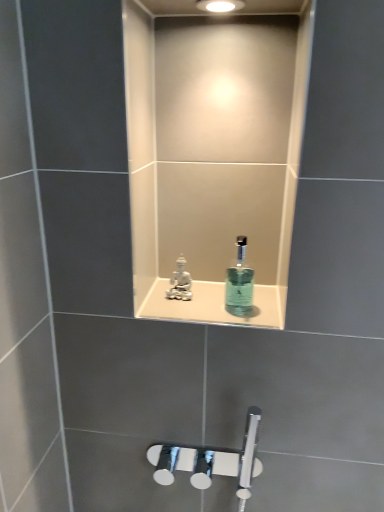
Question: Can you confirm if white glossy statue at center is taller than translucent glass mouthwash at center?

Choices:
 (A) yes
 (B) no

Answer: (B)

Question: From the image's perspective, is white glossy statue at center located above translucent glass mouthwash at center?

Choices:
 (A) yes
 (B) no

Answer: (B)

Question: Does white glossy statue at center lie behind translucent glass mouthwash at center?

Choices:
 (A) yes
 (B) no

Answer: (A)

Question: Does white glossy statue at center have a larger size compared to translucent glass mouthwash at center?

Choices:
 (A) yes
 (B) no

Answer: (B)

Question: Is translucent glass mouthwash at center at the back of white glossy statue at center?

Choices:
 (A) yes
 (B) no

Answer: (B)

Question: From a real-world perspective, is translucent glass mouthwash at center above or below white glossy statue at center?

Choices:
 (A) below
 (B) above

Answer: (B)

Question: Based on their positions, is translucent glass mouthwash at center located to the left or right of white glossy statue at center?

Choices:
 (A) left
 (B) right

Answer: (B)

Question: Would you say translucent glass mouthwash at center is inside or outside white glossy statue at center?

Choices:
 (A) outside
 (B) inside

Answer: (A)

Question: From their relative heights in the image, would you say translucent glass mouthwash at center is taller or shorter than white glossy statue at center?

Choices:
 (A) tall
 (B) short

Answer: (A)

Question: Looking at their shapes, would you say translucent glass mouthwash at center is wider or thinner than white porcelain figurine at center?

Choices:
 (A) wide
 (B) thin

Answer: (A)

Question: Is translucent glass mouthwash at center situated inside white porcelain figurine at center or outside?

Choices:
 (A) outside
 (B) inside

Answer: (A)

Question: Does point (246, 237) appear closer or farther from the camera than point (173, 286)?

Choices:
 (A) farther
 (B) closer

Answer: (A)

Question: In terms of size, does translucent glass mouthwash at center appear bigger or smaller than white porcelain figurine at center?

Choices:
 (A) big
 (B) small

Answer: (A)

Question: From a real-world perspective, relative to translucent glass mouthwash at center, is white glossy statue at center vertically above or below?

Choices:
 (A) above
 (B) below

Answer: (B)

Question: Considering the positions of point (195, 283) and point (238, 250), is point (195, 283) closer or farther from the camera than point (238, 250)?

Choices:
 (A) farther
 (B) closer

Answer: (A)